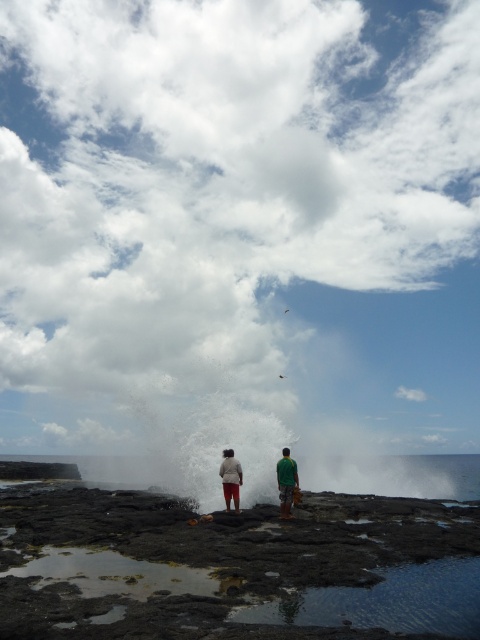
You are a photographer trying to capture a clear shot of the green matte shirt at center and the matte white pants at center. Since the camera can only focus on one subject at a time, which one should you choose to ensure it appears sharp in the photo?

The green matte shirt at center is bigger than the matte white pants at center, so you should focus on the green matte shirt at center to ensure it appears sharp in the photo.